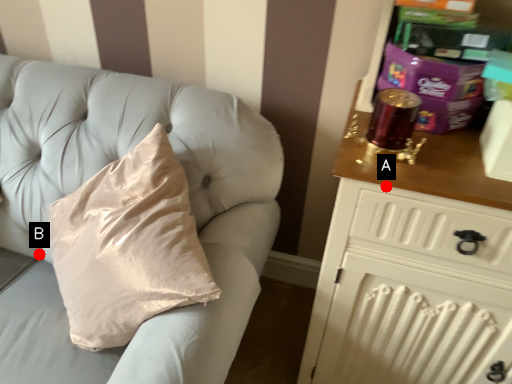
Question: Two points are circled on the image, labeled by A and B beside each circle. Which of the following is the closest to the observer?

Choices:
 (A) A is closer
 (B) B is closer

Answer: (A)